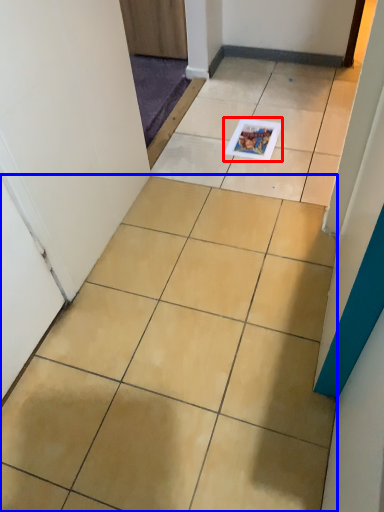
Question: Which object is further to the camera taking this photo, magazine (highlighted by a red box) or ceramic tile (highlighted by a blue box)?

Choices:
 (A) magazine
 (B) ceramic tile

Answer: (A)